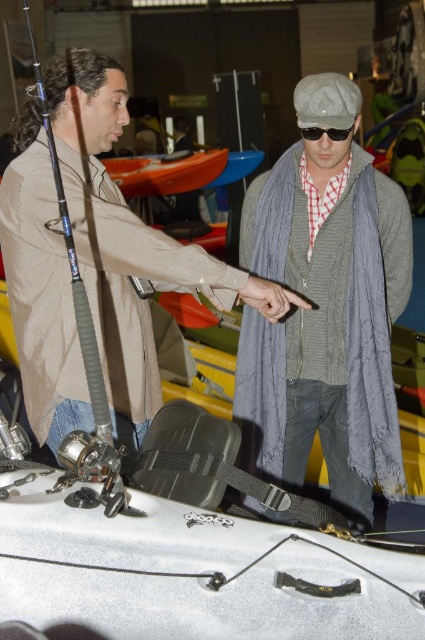
You are organizing an outdoor event and need to arrange items on a table. The matte gray scarf at center and the blue matte fishing pole at left are both on the table. Which item takes up more horizontal space on the table?

The matte gray scarf at center takes up more horizontal space because its width surpasses that of the blue matte fishing pole at left.

You are at an outdoor event with a booth that has a matte gray scarf at center and a blue matte fishing pole at left. If you want to see both items clearly, which one should you move first?

→ The blue matte fishing pole at left is behind the matte gray scarf at center, so you should move the matte gray scarf at center first to see both items clearly.

You are attending an outdoor gear expo and notice two items displayed at the center of a booth. The items are the matte gray scarf at center and the black matte sunglasses at center. Which item is taller?

The matte gray scarf at center is taller than the black matte sunglasses at center.